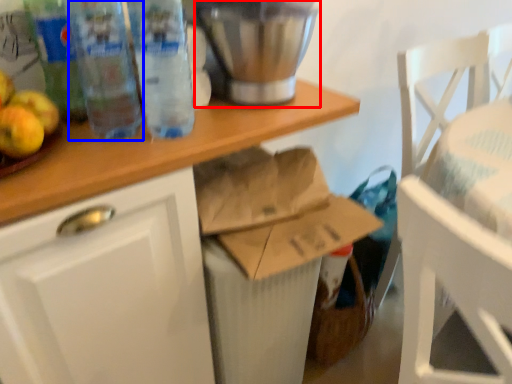
Question: Which object appears farthest to the camera in this image, appliance (highlighted by a red box) or bottle (highlighted by a blue box)?

Choices:
 (A) appliance
 (B) bottle

Answer: (A)